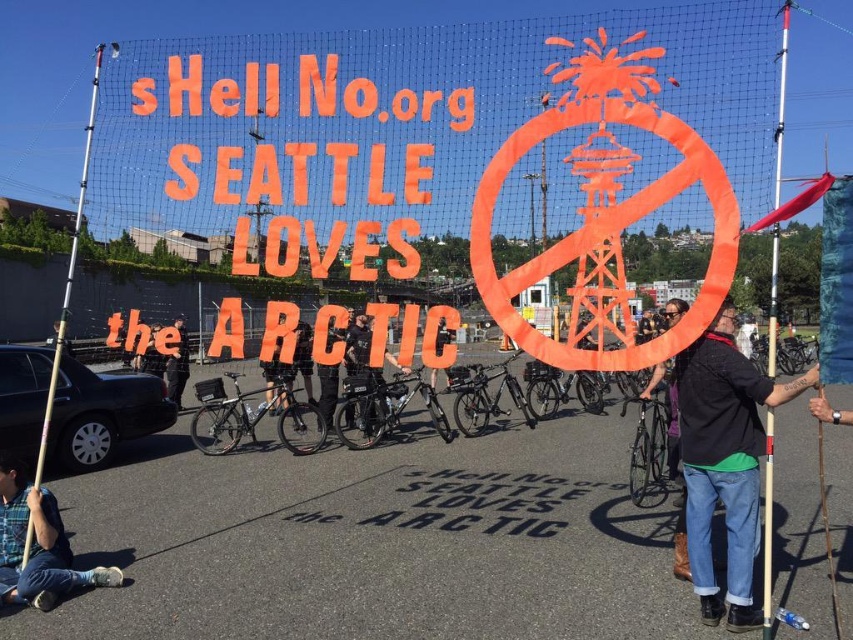
Does point (744, 483) come in front of point (49, 552)?

Yes, it is in front of point (49, 552).

Is point (759, 388) behind point (44, 500)?

No, (759, 388) is closer to viewer.

Find the location of `black fabric shirt at center`. black fabric shirt at center is located at coordinates (724, 461).

The height and width of the screenshot is (640, 853). What do you see at coordinates (38, 547) in the screenshot? I see `blue plaid shirt at lower left` at bounding box center [38, 547].

Is blue plaid shirt at lower left shorter than silver metallic pole at left?

Yes, blue plaid shirt at lower left is shorter than silver metallic pole at left.

Which is behind, point (20, 520) or point (78, 214)?

Point (78, 214)

Image resolution: width=853 pixels, height=640 pixels. I want to click on blue plaid shirt at lower left, so click(x=38, y=547).

Who is more forward, [689,440] or [51,381]?

Point [689,440]

Can you confirm if black fabric shirt at center is wider than silver metallic pole at left?

No.

Where is `black fabric shirt at center`? The width and height of the screenshot is (853, 640). black fabric shirt at center is located at coordinates (724, 461).